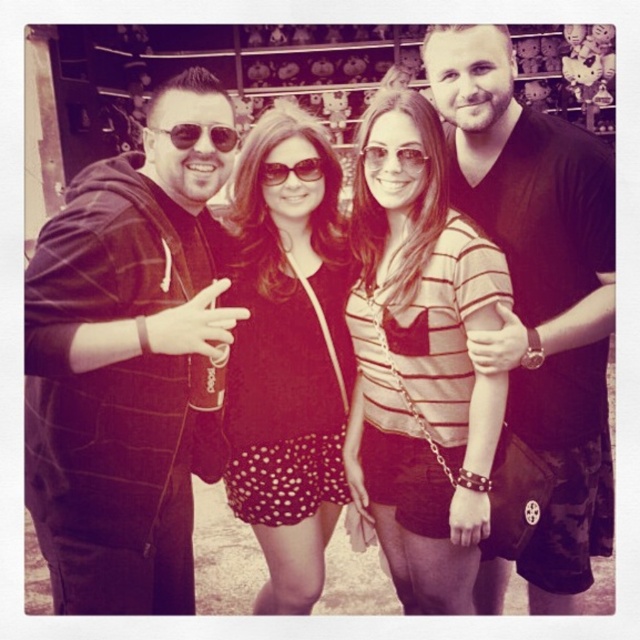
Based on the photo, is sunglasses at center shorter than matte black sunglasses at center?

Yes, sunglasses at center is shorter than matte black sunglasses at center.

Which is behind, point (276, 163) or point (369, 145)?

Positioned behind is point (276, 163).

Locate an element on the screen. This screenshot has height=640, width=640. sunglasses at center is located at coordinates (291, 170).

Who is higher up, polka dot fabric dress at center or matte black sunglasses at center?

matte black sunglasses at center is higher up.

Is point (340, 356) less distant than point (384, 157)?

No, (340, 356) is behind (384, 157).

Is point (266, 225) behind point (371, 172)?

Yes.

Identify the location of polka dot fabric dress at center. The height and width of the screenshot is (640, 640). (289, 358).

Between black textured hoodie at left and polka dot fabric dress at center, which one is positioned lower?

black textured hoodie at left is lower down.

Who is positioned more to the right, black textured hoodie at left or polka dot fabric dress at center?

Positioned to the right is polka dot fabric dress at center.

Does point (100, 488) come closer to viewer compared to point (326, 476)?

Yes, it is in front of point (326, 476).

I want to click on black textured hoodie at left, so click(120, 376).